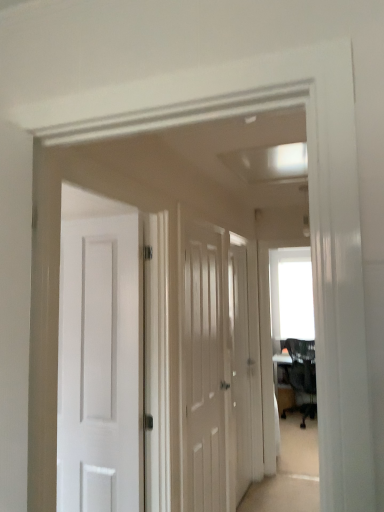
Question: From a real-world perspective, is black mesh chair at right positioned under white wood door at center, the second door positioned from the right, based on gravity?

Choices:
 (A) yes
 (B) no

Answer: (A)

Question: From a real-world perspective, is black mesh chair at right located higher than white wood door at center, the second door positioned from the right?

Choices:
 (A) yes
 (B) no

Answer: (B)

Question: Considering the relative positions of black mesh chair at right and white wood door at center, the 2th door from the back, in the image provided, is black mesh chair at right in front of white wood door at center, the 2th door from the back,?

Choices:
 (A) no
 (B) yes

Answer: (A)

Question: Can you confirm if black mesh chair at right is positioned to the left of white wood door at center, the second door positioned from the right?

Choices:
 (A) yes
 (B) no

Answer: (B)

Question: Is black mesh chair at right not within white wood door at center, the 2th door from the back?

Choices:
 (A) yes
 (B) no

Answer: (A)

Question: Looking at the image, does black mesh chair at right seem bigger or smaller compared to white wood door at center, the 2th door from the back?

Choices:
 (A) big
 (B) small

Answer: (A)

Question: Looking at their shapes, would you say black mesh chair at right is wider or thinner than white wood door at center, which ranks as the 1th door in front-to-back order?

Choices:
 (A) wide
 (B) thin

Answer: (A)

Question: Considering their positions, is black mesh chair at right located in front of or behind white wood door at center, which ranks as the 1th door in front-to-back order?

Choices:
 (A) front
 (B) behind

Answer: (B)

Question: Is black mesh chair at right spatially inside white wood door at center, which appears as the first door when viewed from the left, or outside of it?

Choices:
 (A) outside
 (B) inside

Answer: (A)

Question: Is white wood door at center, the second door positioned from the right, inside the boundaries of black mesh chair at right, or outside?

Choices:
 (A) inside
 (B) outside

Answer: (B)

Question: Relative to black mesh chair at right, is white wood door at center, the second door positioned from the right, in front or behind?

Choices:
 (A) behind
 (B) front

Answer: (B)

Question: Would you say white wood door at center, the 2th door from the back, is to the left or to the right of black mesh chair at right in the picture?

Choices:
 (A) right
 (B) left

Answer: (B)

Question: From a real-world perspective, relative to black mesh chair at right, is white wood door at center, the 2th door from the back, vertically above or below?

Choices:
 (A) above
 (B) below

Answer: (A)

Question: Is white wood door at center, the 2th door from the back, to the left or to the right of white wooden door at center, placed as the 1th door when sorted from back to front, in the image?

Choices:
 (A) left
 (B) right

Answer: (A)

Question: Choose the correct answer: Is white wood door at center, which appears as the first door when viewed from the left, inside white wooden door at center, arranged as the 1th door when viewed from the right, or outside it?

Choices:
 (A) outside
 (B) inside

Answer: (A)